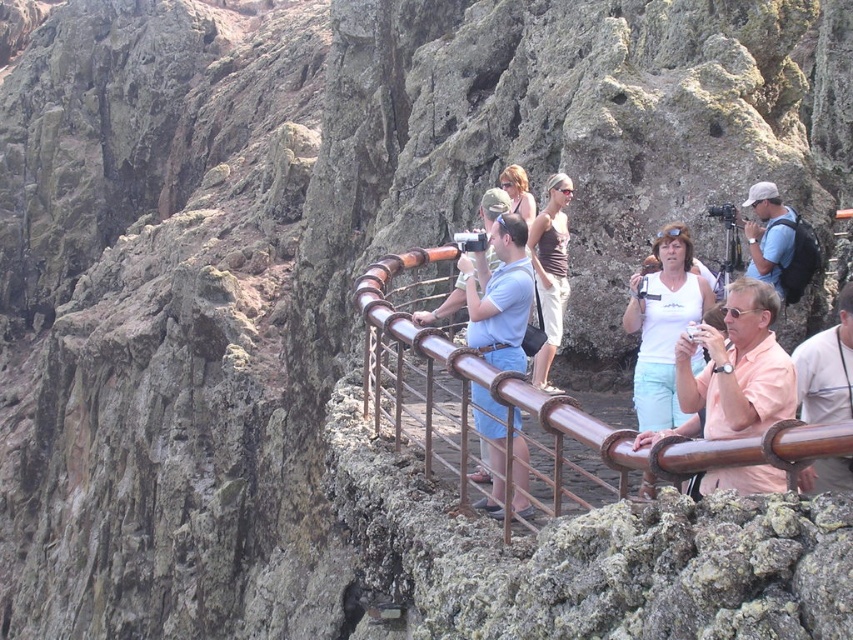
Question: Which point is farther to the camera?

Choices:
 (A) (498, 177)
 (B) (531, 224)

Answer: (A)

Question: Is brown metal railing at center bigger than pink matte shirt at center?

Choices:
 (A) no
 (B) yes

Answer: (B)

Question: Which object appears closest to the camera in this image?

Choices:
 (A) matte brown tank top at center
 (B) blonde hair at center
 (C) pink matte shirt at center
 (D) matte blue shirt at center

Answer: (C)

Question: Does brown metal railing at center have a greater width compared to blonde hair at center?

Choices:
 (A) no
 (B) yes

Answer: (B)

Question: Which object is positioned farthest from the pink matte shirt at center?

Choices:
 (A) matte blue shirt at center
 (B) matte brown tank top at center
 (C) white matte tank top at center
 (D) blonde hair at center

Answer: (D)

Question: Where is pink matte shirt at center located in relation to matte brown tank top at center in the image?

Choices:
 (A) left
 (B) right

Answer: (B)